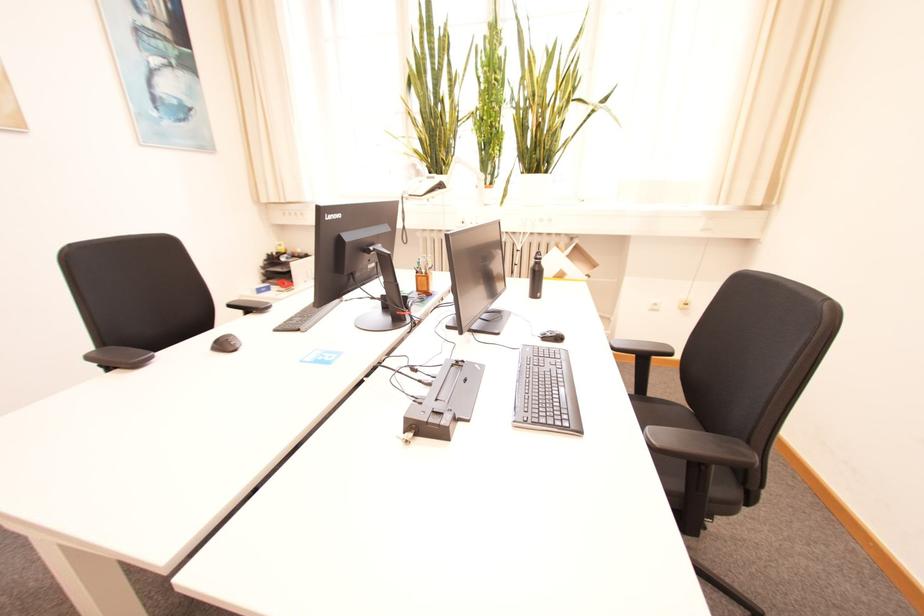
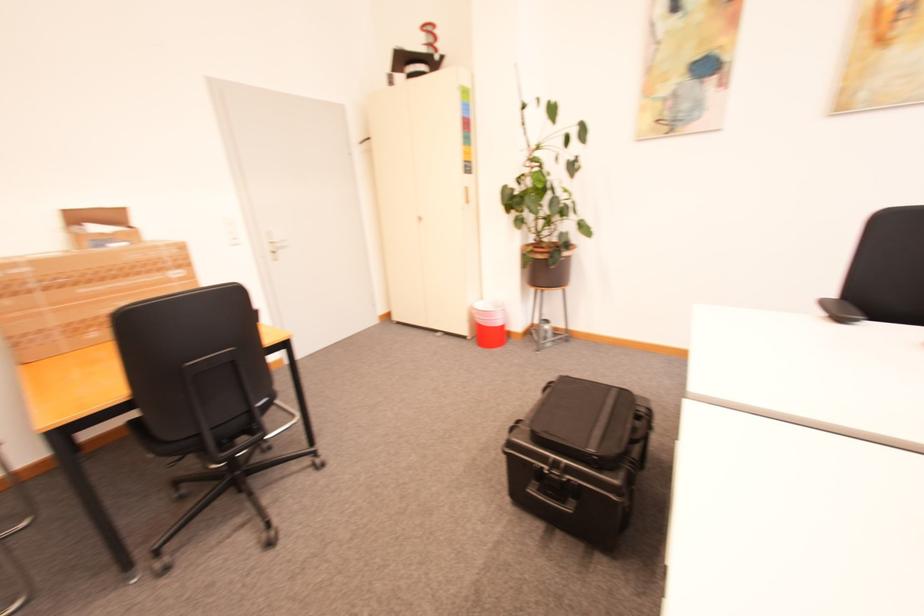
How did the camera likely rotate?

The camera's rotation is toward left-down.